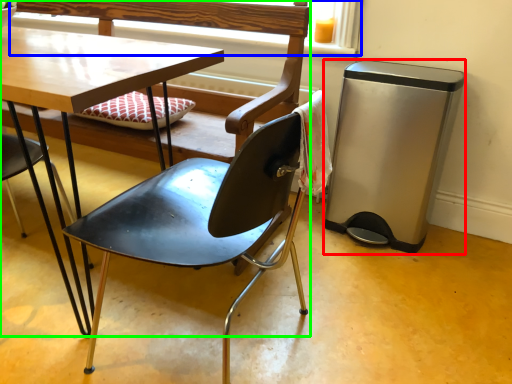
Question: Which object is positioned farthest from trash bin/can (highlighted by a red box)? Select from window frame (highlighted by a blue box) and chair (highlighted by a green box).

Choices:
 (A) window frame
 (B) chair

Answer: (B)